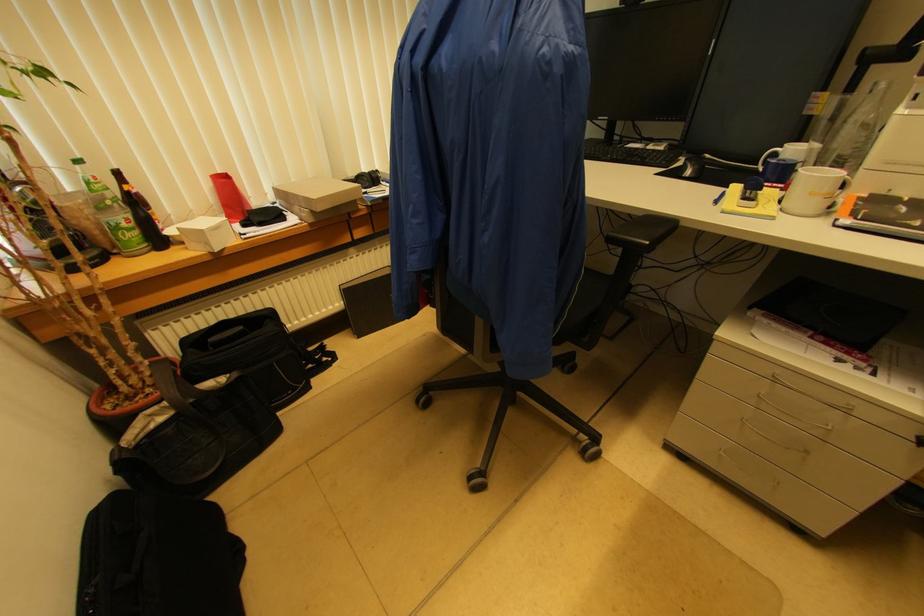
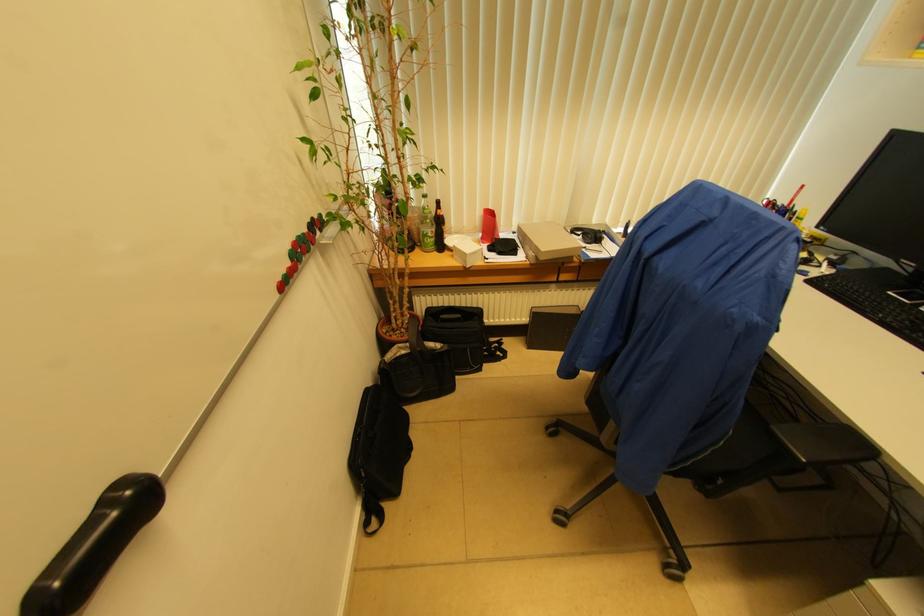
Locate, in the second image, the point that corresponds to point 373,177 in the first image.

(599, 237)